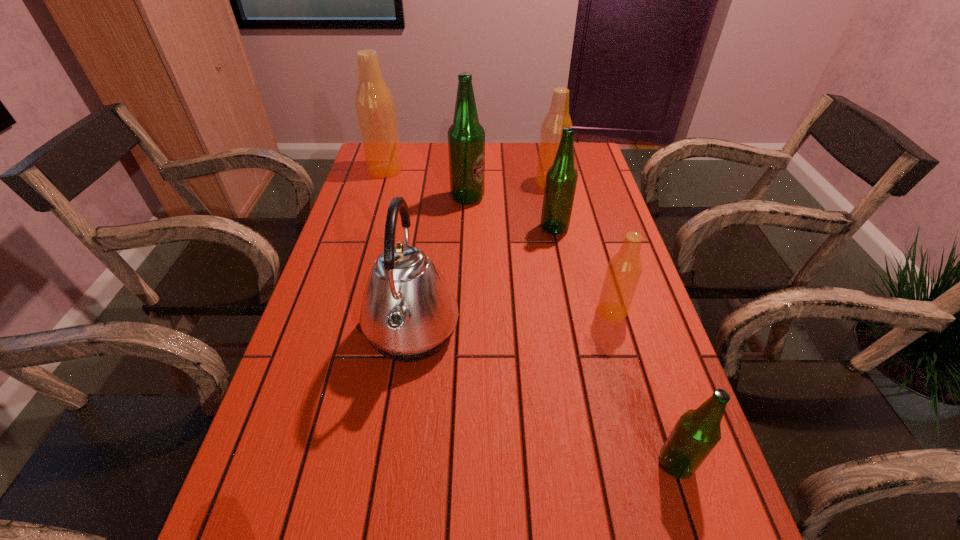
Locate an element on the screen. green beer bottle identified as the second closest to the kettle is located at coordinates (466, 137).

You are a GUI agent. You are given a task and a screenshot of the screen. Output one action in this format:
    pyautogui.click(x=<x>, y=<y>)
    Task: Click on the green beer bottle identified as the second closest to the second green beer bottle from left to right
    The height and width of the screenshot is (540, 960).
    Given the screenshot: What is the action you would take?
    pyautogui.click(x=697, y=432)

Identify which tan beer bottle is located as the second nearest to the second biggest tan beer bottle. Please provide its 2D coordinates. Your answer should be formatted as a tuple, i.e. [(x, y)], where the tuple contains the x and y coordinates of a point satisfying the conditions above.

[(624, 270)]

Identify which tan beer bottle is the nearest to the kettle. Please provide its 2D coordinates. Your answer should be formatted as a tuple, i.e. [(x, y)], where the tuple contains the x and y coordinates of a point satisfying the conditions above.

[(624, 270)]

I want to click on vacant space that satisfies the following two spatial constraints: 1. on the front side of the second biggest tan beer bottle; 2. on the label of the farthest green beer bottle, so click(554, 198).

You are a GUI agent. You are given a task and a screenshot of the screen. Output one action in this format:
    pyautogui.click(x=<x>, y=<y>)
    Task: Click on the vacant area that satisfies the following two spatial constraints: 1. on the label of the farthest green beer bottle; 2. on the left side of the smallest tan beer bottle
    The width and height of the screenshot is (960, 540).
    Given the screenshot: What is the action you would take?
    pyautogui.click(x=464, y=312)